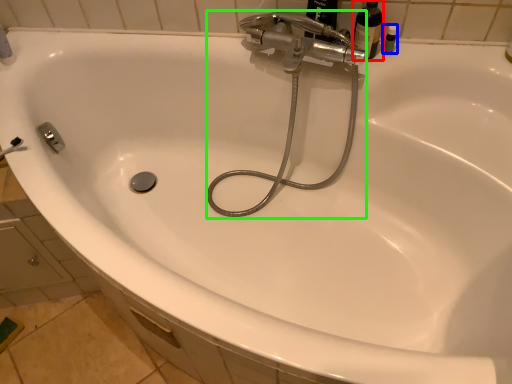
Question: Based on their relative distances, which object is nearer to bottle (highlighted by a red box)? Choose from toiletry (highlighted by a blue box) and plumbing fixture (highlighted by a green box).

Choices:
 (A) toiletry
 (B) plumbing fixture

Answer: (A)